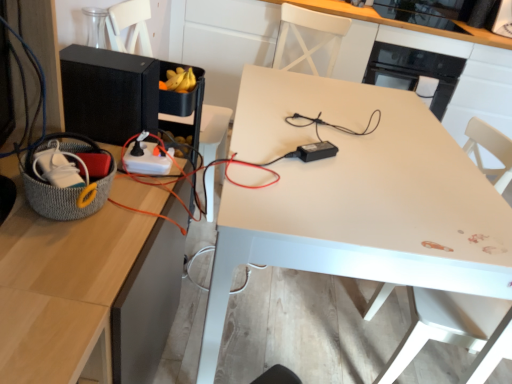
Find the location of a particular element. The height and width of the screenshot is (384, 512). free location in front of black plastic power adapter at center, the 3th appliance in the back-to-front sequence is located at coordinates (334, 193).